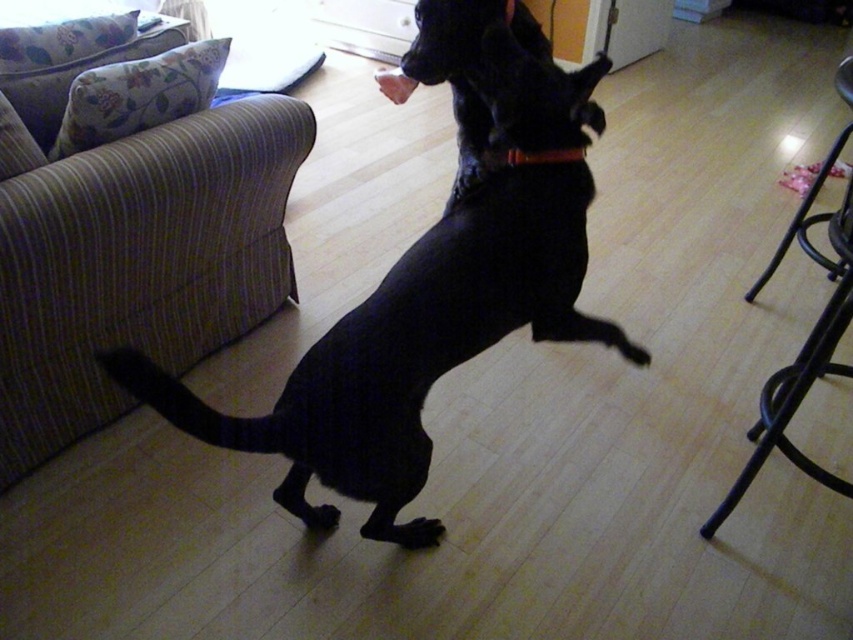
Consider the image. Can you confirm if striped fabric couch at left is positioned to the right of black fur paw at lower center?

Incorrect, striped fabric couch at left is not on the right side of black fur paw at lower center.

Does striped fabric couch at left come in front of black fur paw at lower center?

Yes.

The height and width of the screenshot is (640, 853). Find the location of `striped fabric couch at left`. striped fabric couch at left is located at coordinates (132, 227).

Can you confirm if black metal stool at lower right is shorter than black leather neckband at center?

In fact, black metal stool at lower right may be taller than black leather neckband at center.

Between black metal stool at lower right and black leather neckband at center, which one has more height?

With more height is black metal stool at lower right.

Is point (798, 355) in front of point (575, 156)?

No, it is not.

Identify the location of black metal stool at lower right. (804, 342).

Is point (84, 381) in front of point (483, 99)?

No, it is not.

Based on the photo, who is more forward, (x=241, y=116) or (x=524, y=42)?

Point (x=524, y=42)

Does point (140, 225) lie behind point (541, 29)?

No.

You are a GUI agent. You are given a task and a screenshot of the screen. Output one action in this format:
    pyautogui.click(x=<x>, y=<y>)
    Task: Click on the striped fabric couch at left
    The image size is (853, 640).
    Given the screenshot: What is the action you would take?
    [132, 227]